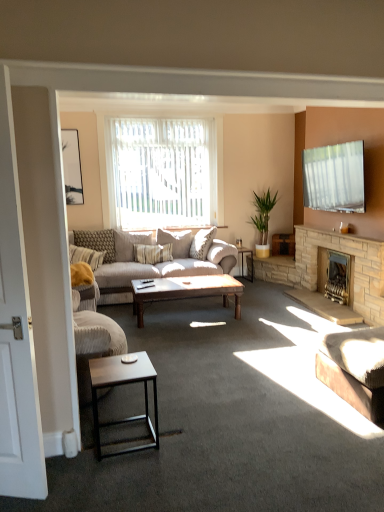
Question: Can you confirm if stone fireplace at right, the 2th fireplace when ordered from back to front, is shorter than beige fabric couch at center, the first studio couch when ordered from left to right?

Choices:
 (A) yes
 (B) no

Answer: (B)

Question: Can you confirm if stone fireplace at right, the 1th fireplace from the front, is taller than beige fabric couch at center, which ranks as the 2th studio couch in right-to-left order?

Choices:
 (A) yes
 (B) no

Answer: (A)

Question: From the image's perspective, does stone fireplace at right, the 1th fireplace from the front, appear lower than beige fabric couch at center, the 2th studio couch positioned from the front?

Choices:
 (A) yes
 (B) no

Answer: (A)

Question: From a real-world perspective, is stone fireplace at right, the 2th fireplace when ordered from back to front, over beige fabric couch at center, the 2th studio couch positioned from the front?

Choices:
 (A) yes
 (B) no

Answer: (B)

Question: Is stone fireplace at right, the 1th fireplace from the front, further to the viewer compared to beige fabric couch at center, which ranks as the first studio couch in back-to-front order?

Choices:
 (A) no
 (B) yes

Answer: (B)

Question: Based on their sizes in the image, would you say dark brown wooden coffee table at center, the second coffee table positioned from the back, is bigger or smaller than beige fabric pillow at center, marked as the 3th pillow in a left-to-right arrangement?

Choices:
 (A) small
 (B) big

Answer: (A)

Question: Is dark brown wooden coffee table at center, the first coffee table positioned from the front, taller or shorter than beige fabric pillow at center, marked as the 3th pillow in a left-to-right arrangement?

Choices:
 (A) tall
 (B) short

Answer: (B)

Question: In the image, is dark brown wooden coffee table at center, the second coffee table positioned from the back, positioned in front of or behind beige fabric pillow at center, marked as the 3th pillow in a left-to-right arrangement?

Choices:
 (A) behind
 (B) front

Answer: (B)

Question: From a real-world perspective, is dark brown wooden coffee table at center, the second coffee table positioned from the back, above or below beige fabric pillow at center, the 1th pillow in the right-to-left sequence?

Choices:
 (A) above
 (B) below

Answer: (B)

Question: Looking at their shapes, would you say green leafy plant at center-right is wider or thinner than white wood screen door at left?

Choices:
 (A) wide
 (B) thin

Answer: (A)

Question: Considering the positions of green leafy plant at center-right and white wood screen door at left in the image, is green leafy plant at center-right bigger or smaller than white wood screen door at left?

Choices:
 (A) small
 (B) big

Answer: (B)

Question: Relative to white wood screen door at left, is green leafy plant at center-right in front or behind?

Choices:
 (A) front
 (B) behind

Answer: (B)

Question: From a real-world perspective, is green leafy plant at center-right physically located above or below white wood screen door at left?

Choices:
 (A) below
 (B) above

Answer: (A)

Question: Is brown textured fabric studio couch at lower right, which is the 2th studio couch in back-to-front order, wider or thinner than wooden coffee table at center, marked as the 1th coffee table in a back-to-front arrangement?

Choices:
 (A) thin
 (B) wide

Answer: (B)

Question: Is brown textured fabric studio couch at lower right, the 2th studio couch positioned from the left, inside the boundaries of wooden coffee table at center, marked as the 1th coffee table in a back-to-front arrangement, or outside?

Choices:
 (A) inside
 (B) outside

Answer: (B)